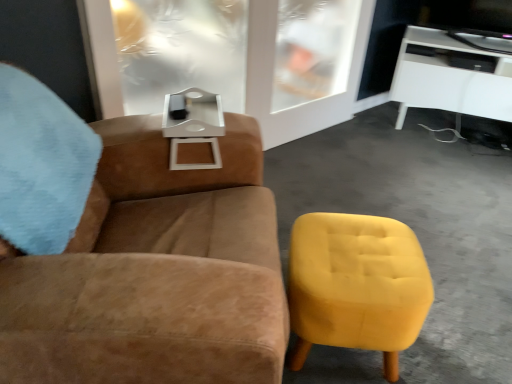
At what (x,y) coordinates should I click in order to perform the action: click on yellow fabric ottoman at lower right. Please return your answer as a coordinate pair (x, y). Looking at the image, I should click on (356, 286).

Measure the distance between point (159, 259) and camera.

The depth of point (159, 259) is 36.65 inches.

Where is `white glossy tv stand at upper right`? white glossy tv stand at upper right is located at coordinates (453, 75).

Locate an element on the screen. This screenshot has height=384, width=512. table below the transparent glass door at upper center (from a real-world perspective) is located at coordinates (453, 75).

Can you confirm if white glossy tv stand at upper right is wider than transparent glass door at upper center?

Correct, the width of white glossy tv stand at upper right exceeds that of transparent glass door at upper center.

In the image, is white glossy tv stand at upper right on the left side or the right side of transparent glass door at upper center?

From the image, it's evident that white glossy tv stand at upper right is to the right of transparent glass door at upper center.

Would you say white glossy tv stand at upper right is a long distance from transparent glass door at upper center?

No, white glossy tv stand at upper right is in close proximity to transparent glass door at upper center.

Between suede brown armchair at upper left and white glossy tv stand at upper right, which one is positioned in front?

Positioned in front is suede brown armchair at upper left.

Is suede brown armchair at upper left not inside white glossy tv stand at upper right?

Yes, suede brown armchair at upper left is not within white glossy tv stand at upper right.

Considering the sizes of objects suede brown armchair at upper left and white glossy tv stand at upper right in the image provided, who is shorter, suede brown armchair at upper left or white glossy tv stand at upper right?

Standing shorter between the two is white glossy tv stand at upper right.

Can we say suede brown armchair at upper left lies outside transparent glass door at upper center?

Absolutely, suede brown armchair at upper left is external to transparent glass door at upper center.

From a real-world perspective, is suede brown armchair at upper left above or below transparent glass door at upper center?

suede brown armchair at upper left is below transparent glass door at upper center.

Which is farther from the camera, (65, 152) or (332, 44)?

The point (332, 44) is farther from the camera.

Which of these two, suede brown armchair at upper left or transparent glass door at upper center, stands shorter?

With less height is transparent glass door at upper center.

Is transparent glass door at upper center touching white glossy tv stand at upper right?

No.

In the image, is transparent glass door at upper center on the left side or the right side of white glossy tv stand at upper right?

From the image, it's evident that transparent glass door at upper center is to the left of white glossy tv stand at upper right.

Would you say transparent glass door at upper center is outside white glossy tv stand at upper right?

That's correct, transparent glass door at upper center is outside of white glossy tv stand at upper right.

Visually, is yellow fabric ottoman at lower right positioned to the left or to the right of transparent glass door at upper center?

yellow fabric ottoman at lower right is to the right of transparent glass door at upper center.

Is yellow fabric ottoman at lower right positioned with its back to transparent glass door at upper center?

No, yellow fabric ottoman at lower right's orientation is not away from transparent glass door at upper center.

Does yellow fabric ottoman at lower right have a greater width compared to transparent glass door at upper center?

Indeed, yellow fabric ottoman at lower right has a greater width compared to transparent glass door at upper center.

Looking at this image, can you confirm if yellow fabric ottoman at lower right is shorter than transparent glass door at upper center?

Yes, yellow fabric ottoman at lower right is shorter than transparent glass door at upper center.

From a real-world perspective, is white glossy tv stand at upper right above or below suede brown armchair at upper left?

white glossy tv stand at upper right is below suede brown armchair at upper left.

Looking at this image, do you think white glossy tv stand at upper right is within suede brown armchair at upper left, or outside of it?

The correct answer is: outside.

Is white glossy tv stand at upper right positioned with its back to suede brown armchair at upper left?

white glossy tv stand at upper right is not turned away from suede brown armchair at upper left.

How different are the orientations of white glossy tv stand at upper right and suede brown armchair at upper left in degrees?

The angle between the facing direction of white glossy tv stand at upper right and the facing direction of suede brown armchair at upper left is 113 degrees.

How many degrees apart are the facing directions of yellow fabric ottoman at lower right and suede brown armchair at upper left?

They differ by 6.74 degrees in their facing directions.

Is the position of yellow fabric ottoman at lower right more distant than that of suede brown armchair at upper left?

Yes, yellow fabric ottoman at lower right is behind suede brown armchair at upper left.

Is yellow fabric ottoman at lower right directly adjacent to suede brown armchair at upper left?

No.

Between yellow fabric ottoman at lower right and suede brown armchair at upper left, which one appears on the right side from the viewer's perspective?

yellow fabric ottoman at lower right.

Where is `table behind the transparent glass door at upper center`? The height and width of the screenshot is (384, 512). table behind the transparent glass door at upper center is located at coordinates (453, 75).

The height and width of the screenshot is (384, 512). Identify the location of chair located above the white glossy tv stand at upper right (from a real-world perspective). (133, 252).

Based on the photo, based on their spatial positions, is white glossy tv stand at upper right or suede brown armchair at upper left further from yellow fabric ottoman at lower right?

The object further to yellow fabric ottoman at lower right is white glossy tv stand at upper right.

From the picture: Considering their positions, is white glossy tv stand at upper right positioned further to transparent glass door at upper center than suede brown armchair at upper left?

The object further to transparent glass door at upper center is suede brown armchair at upper left.

When comparing their distances from white glossy tv stand at upper right, does transparent glass door at upper center or yellow fabric ottoman at lower right seem further?

Among the two, yellow fabric ottoman at lower right is located further to white glossy tv stand at upper right.

Based on their spatial positions, is yellow fabric ottoman at lower right or white glossy tv stand at upper right further from suede brown armchair at upper left?

Based on the image, white glossy tv stand at upper right appears to be further to suede brown armchair at upper left.

From the image, which object appears to be nearer to suede brown armchair at upper left, yellow fabric ottoman at lower right or transparent glass door at upper center?

yellow fabric ottoman at lower right lies closer to suede brown armchair at upper left than the other object.

From the image, which object appears to be farther from yellow fabric ottoman at lower right, suede brown armchair at upper left or transparent glass door at upper center?

Among the two, transparent glass door at upper center is located further to yellow fabric ottoman at lower right.

When comparing their distances from suede brown armchair at upper left, does transparent glass door at upper center or yellow fabric ottoman at lower right seem closer?

The object closer to suede brown armchair at upper left is yellow fabric ottoman at lower right.

Based on the photo, looking at the image, which one is located closer to transparent glass door at upper center, white glossy tv stand at upper right or yellow fabric ottoman at lower right?

Among the two, white glossy tv stand at upper right is located nearer to transparent glass door at upper center.

Locate an element on the screen. chair between transparent glass door at upper center and yellow fabric ottoman at lower right in the up-down direction is located at coordinates (133, 252).

This screenshot has height=384, width=512. I want to click on swivel chair between suede brown armchair at upper left and white glossy tv stand at upper right from front to back, so click(356, 286).

Identify the location of swivel chair between transparent glass door at upper center and white glossy tv stand at upper right in the horizontal direction. (356, 286).

The width and height of the screenshot is (512, 384). I want to click on glass door between suede brown armchair at upper left and white glossy tv stand at upper right, so click(x=320, y=76).